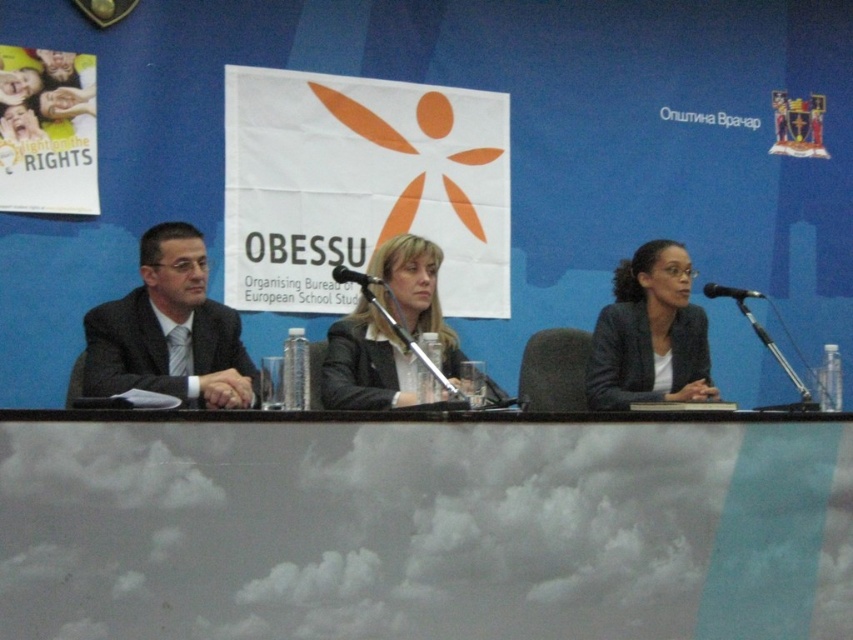
You are a photographer positioned behind the table. You need to capture a photo where the black glossy suit at center is clearly visible above the metallic silver microphone at center. Based on the scene description, will this be possible?

Yes, because the black glossy suit at center is taller than the metallic silver microphone at center, allowing it to be visible above it in the photo.

You are a photographer positioned behind the table. You need to capture a closeup of the black glossy suit at center and the metallic silver microphone at center without any obstruction. Which object should you move closer to first to ensure both are in frame?

The black glossy suit at center is wider than the metallic silver microphone at center, so you should move closer to the black glossy suit at center first to ensure both fit within the camera frame.